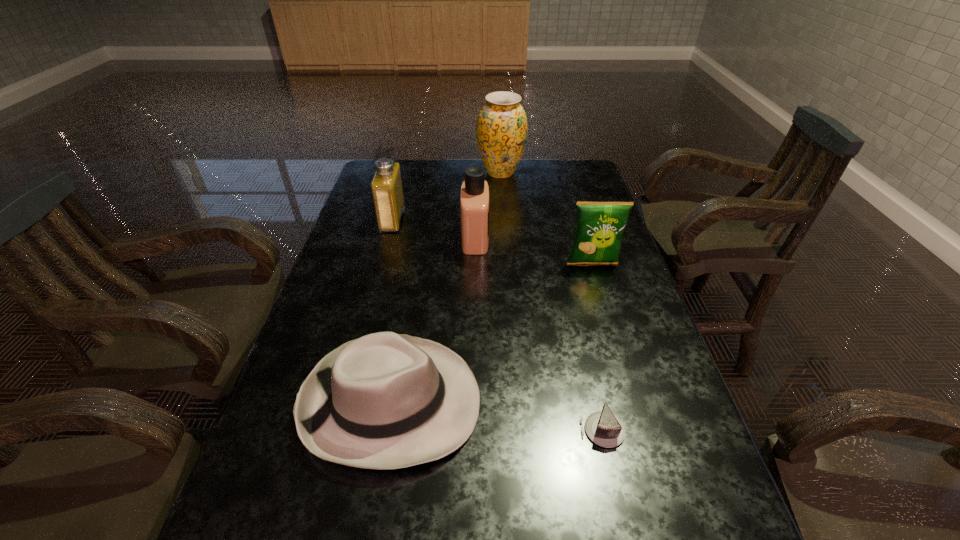
Locate an element on the screen. This screenshot has height=540, width=960. the tallest object is located at coordinates (501, 131).

Where is `vase`? vase is located at coordinates (501, 131).

Where is `the left perfume`? This screenshot has height=540, width=960. the left perfume is located at coordinates (386, 186).

Image resolution: width=960 pixels, height=540 pixels. In order to click on the right perfume in this screenshot , I will do `click(474, 197)`.

Image resolution: width=960 pixels, height=540 pixels. I want to click on the third nearest object, so click(599, 228).

Identify the location of the fifth tallest object. (385, 400).

At what (x,y) coordinates should I click in order to perform the action: click on chocolate cake. Please return your answer as a coordinate pair (x, y). The height and width of the screenshot is (540, 960). Looking at the image, I should click on (603, 428).

I want to click on free space located 0.210m on the front of the vase, so (504, 215).

You are a GUI agent. You are given a task and a screenshot of the screen. Output one action in this format:
    pyautogui.click(x=<x>, y=<y>)
    Task: Click on the vacant space located 0.120m on the front-facing side of the left perfume
    The height and width of the screenshot is (540, 960).
    Given the screenshot: What is the action you would take?
    pyautogui.click(x=440, y=219)

Locate an element on the screen. Image resolution: width=960 pixels, height=540 pixels. vacant space situated on the front label of the right perfume is located at coordinates (534, 239).